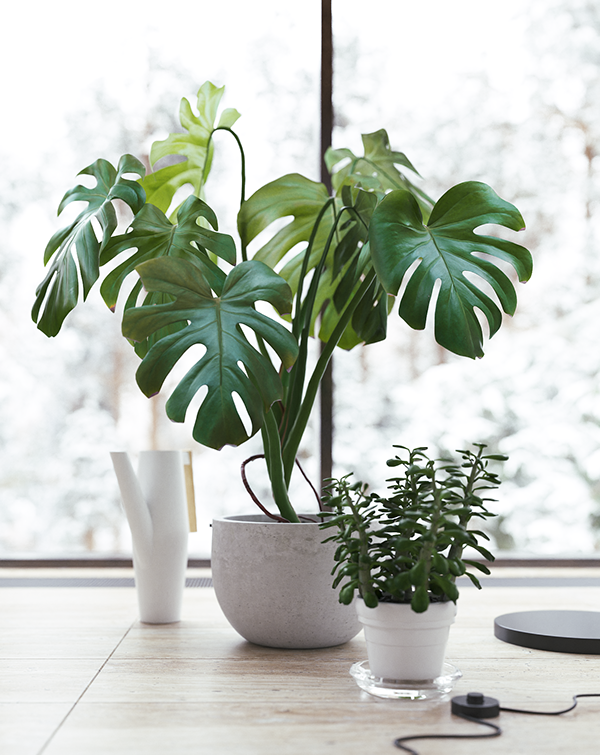
Locate an element on the screen. The width and height of the screenshot is (600, 755). plant is located at coordinates (276, 461).